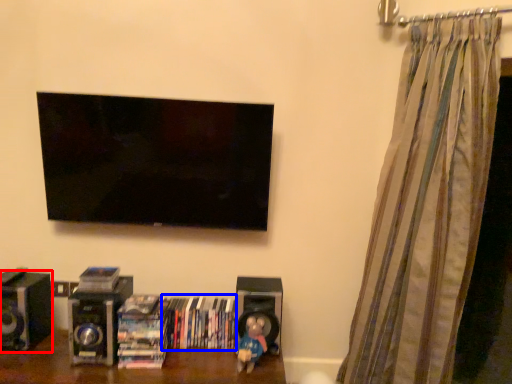
Question: Which object appears closest to the camera in this image, speaker (highlighted by a red box) or book (highlighted by a blue box)?

Choices:
 (A) speaker
 (B) book

Answer: (A)